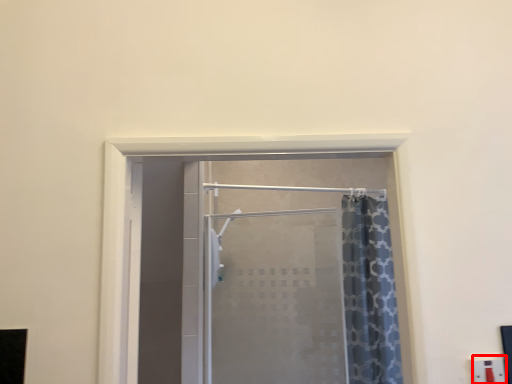
Question: From the image's perspective, what is the correct spatial relationship of electric outlet (annotated by the red box) in relation to door?

Choices:
 (A) above
 (B) below

Answer: (A)